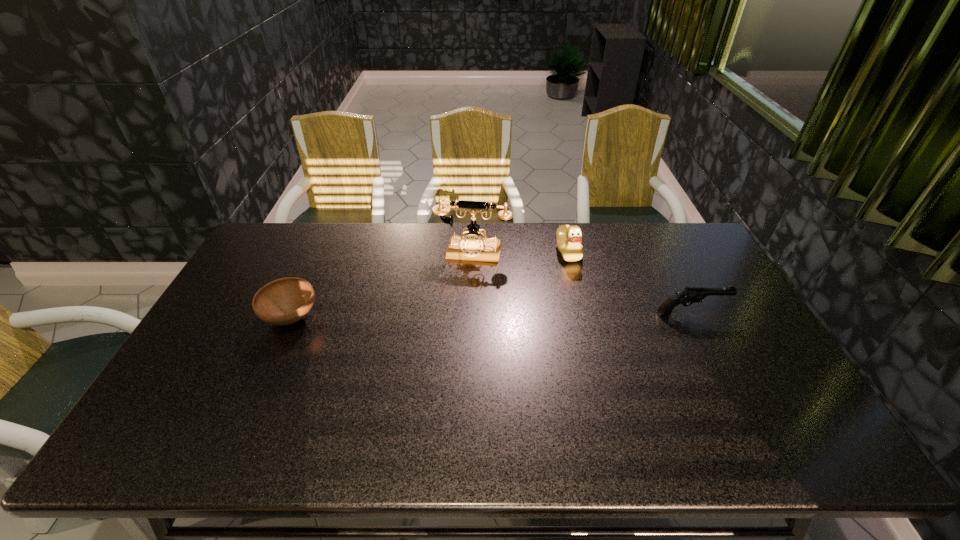
This screenshot has width=960, height=540. What are the coordinates of `vacant point located between the telephone and the third tallest object` in the screenshot? It's located at (582, 283).

At what (x,y) coordinates should I click in order to perform the action: click on free space that is in between the second object from right to left and the tallest object. Please return your answer as a coordinate pair (x, y). Image resolution: width=960 pixels, height=540 pixels. Looking at the image, I should click on (520, 252).

Identify the location of empty space that is in between the telephone and the third object from left to right. The height and width of the screenshot is (540, 960). (520, 252).

Locate an element on the screen. The image size is (960, 540). empty location between the gun and the leftmost object is located at coordinates (492, 315).

At what (x,y) coordinates should I click in order to perform the action: click on object that is the third closest one to the tallest object. Please return your answer as a coordinate pair (x, y). Looking at the image, I should click on (690, 295).

Identify the location of object that is the closest one to the second object from left to right. (569, 238).

Identify the location of free space that satisfies the following two spatial constraints: 1. on the back side of the telephone; 2. on the right side of the duck. Image resolution: width=960 pixels, height=540 pixels. (472, 252).

Where is `vacant space that satisfies the following two spatial constraints: 1. on the front side of the gun; 2. at the end of the barrel of the telephone`? vacant space that satisfies the following two spatial constraints: 1. on the front side of the gun; 2. at the end of the barrel of the telephone is located at coordinates (471, 314).

The width and height of the screenshot is (960, 540). Identify the location of blank area in the image that satisfies the following two spatial constraints: 1. on the front side of the third tallest object; 2. at the end of the barrel of the tallest object. (471, 314).

Find the location of a particular element. Image resolution: width=960 pixels, height=540 pixels. free location that satisfies the following two spatial constraints: 1. on the back side of the bowl; 2. on the left side of the third object from right to left is located at coordinates point(320,253).